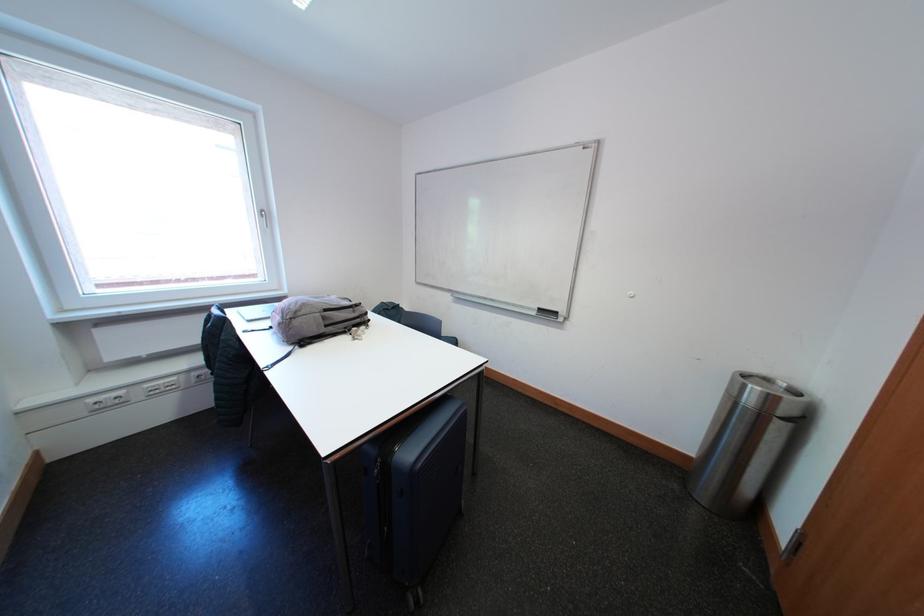
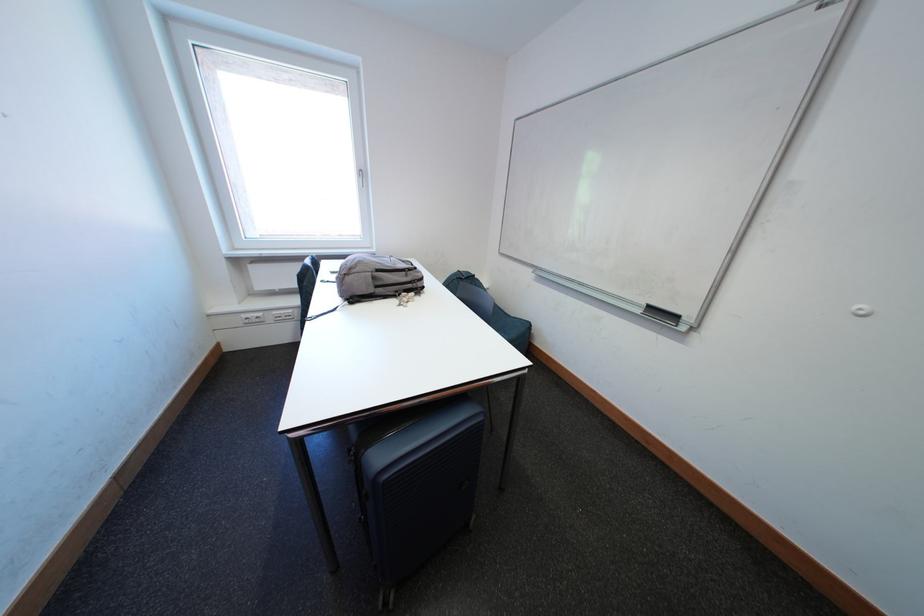
Find the pixel in the second image that matches (355,331) in the first image.

(406, 294)